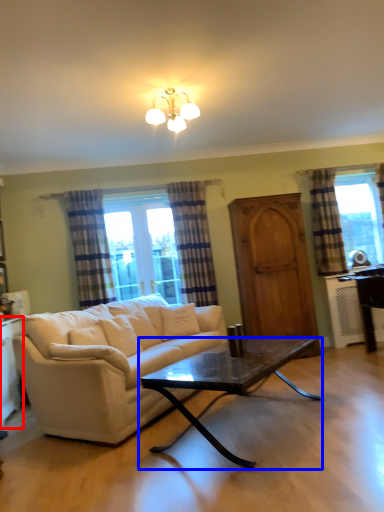
Question: Which point is further to the camera, cabinetry (highlighted by a red box) or coffee table (highlighted by a blue box)?

Choices:
 (A) cabinetry
 (B) coffee table

Answer: (A)